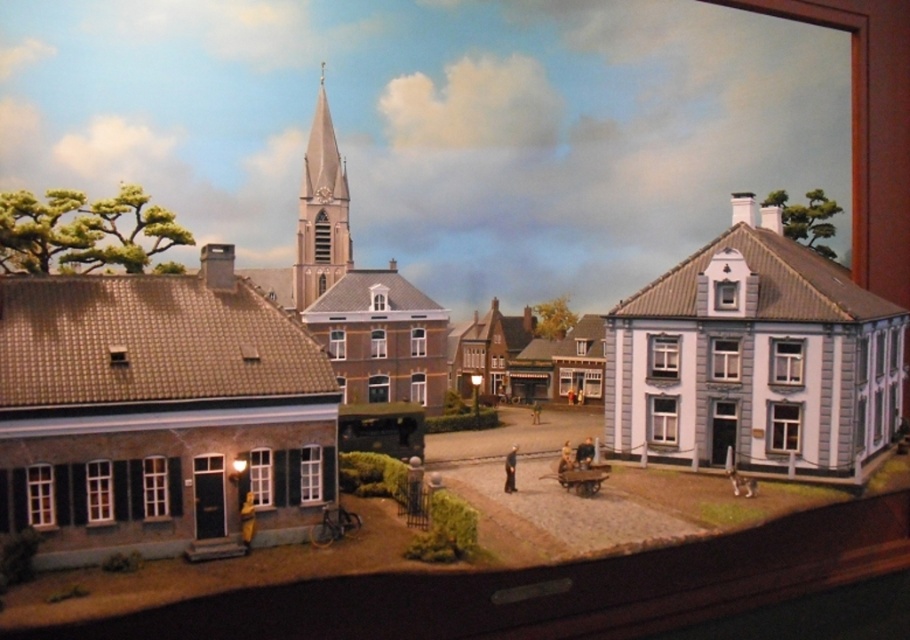
You are a visitor in the village and want to take a photo of the light beige stone spire at center without the white painted wood house at center right blocking it. How should you position yourself?

Move to the left side of the cobblestone street so that the white painted wood house at center right is no longer blocking the view of the light beige stone spire at center.

You are a visitor in this village and want to take a photo of the white painted wood house at center right and the light beige stone spire at center. Which object should you focus on first if you want to include both in a single frame without zooming in?

The white painted wood house at center right is larger in size than the light beige stone spire at center. To include both in a single frame without zooming in, focus on the smaller object first, which is the light beige stone spire at center, as it requires less space in the frame.

You are a visitor in the village and want to take a photo of both the brown textured brick church at left and the light beige stone spire at center. Which object should you position closer to the camera to ensure both are fully visible in the frame?

You should position the brown textured brick church at left closer to the camera because it is shorter than the light beige stone spire at center, allowing both to fit within the frame.